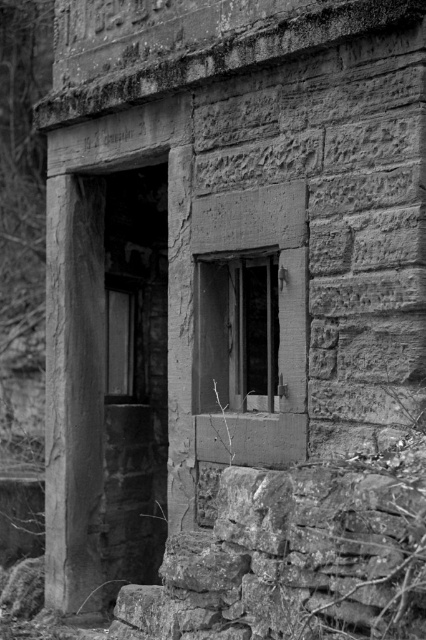
Can you confirm if wooden frame at center is smaller than smooth glass window at center?

No.

Who is taller, wooden frame at center or smooth glass window at center?

smooth glass window at center is taller.

Is point (238, 385) positioned in front of point (115, 296)?

Yes, point (238, 385) is in front of point (115, 296).

This screenshot has width=426, height=640. I want to click on wooden frame at center, so click(x=238, y=332).